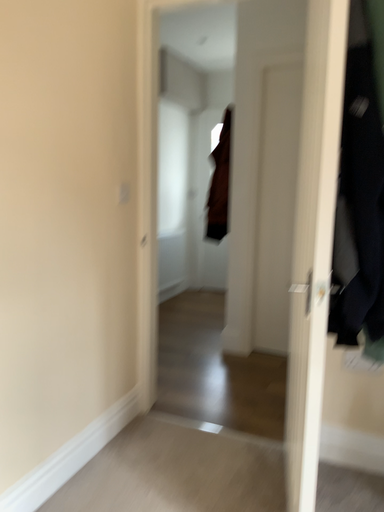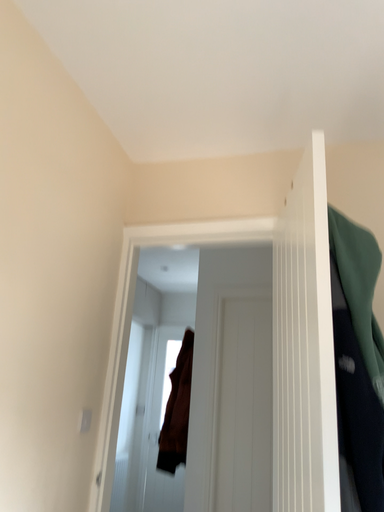
Question: Which way did the camera rotate in the video?

Choices:
 (A) rotated right
 (B) rotated left

Answer: (A)